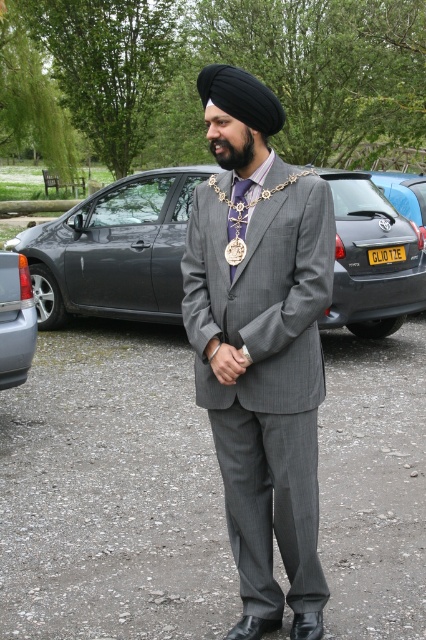
Is point (279, 340) farther from viewer compared to point (420, 196)?

No.

Does gray pinstripe suit at center lie behind blue metallic car at center?

No, it is in front of blue metallic car at center.

This screenshot has height=640, width=426. Find the location of `gray pinstripe suit at center`. gray pinstripe suit at center is located at coordinates (261, 352).

Does black fuzzy beard at center have a larger size compared to yellow metallic license plate at center?

Yes.

Is point (213, 138) positioned behind point (391, 253)?

That is False.

Identify the location of black fuzzy beard at center. The image size is (426, 640). pos(233,150).

Is black fuzzy beard at center above purple satin tie at center?

Indeed, black fuzzy beard at center is positioned over purple satin tie at center.

Is black fuzzy beard at center closer to the viewer compared to purple satin tie at center?

Yes.

I want to click on black fuzzy beard at center, so click(x=233, y=150).